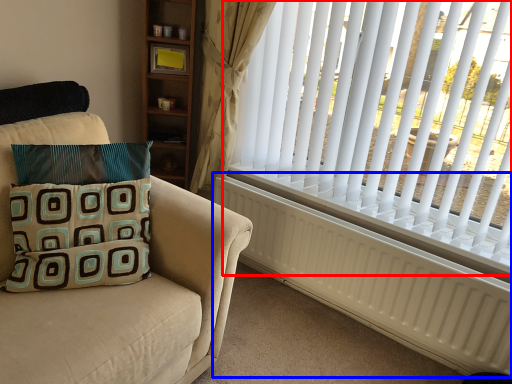
Question: Which object is closer to the camera taking this photo, window blind (highlighted by a red box) or radiator (highlighted by a blue box)?

Choices:
 (A) window blind
 (B) radiator

Answer: (A)